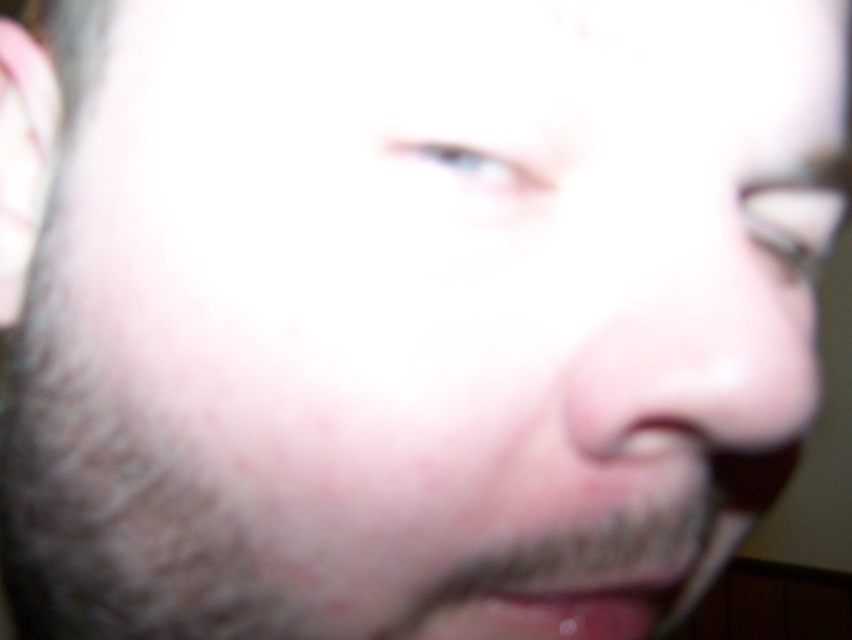
Between pink smooth nose at center and pink glossy lips at lower center, which one appears on the left side from the viewer's perspective?

pink glossy lips at lower center is more to the left.

Image resolution: width=852 pixels, height=640 pixels. Find the location of `pink smooth nose at center`. pink smooth nose at center is located at coordinates click(x=699, y=355).

The image size is (852, 640). Identify the location of pink smooth nose at center. (699, 355).